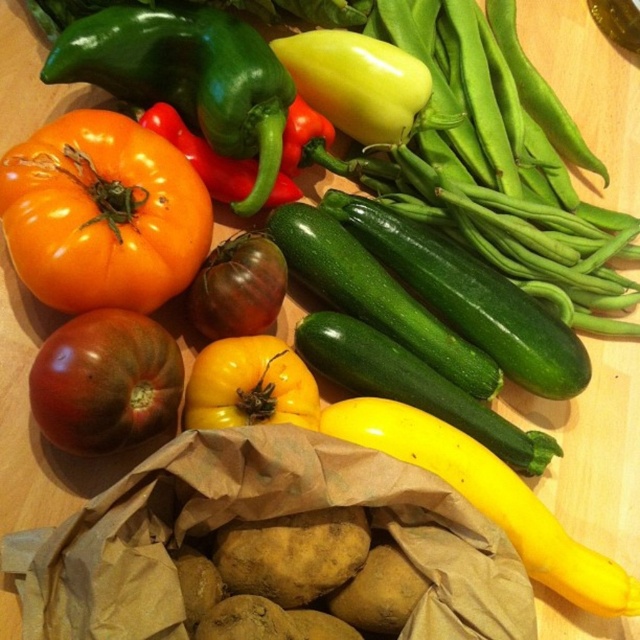
Which is above, rustic brown tomato at center-left or green glossy pepper at upper center?

green glossy pepper at upper center

Is rustic brown tomato at center-left closer to camera compared to green glossy pepper at upper center?

Yes, rustic brown tomato at center-left is in front of green glossy pepper at upper center.

This screenshot has height=640, width=640. I want to click on rustic brown tomato at center-left, so 106,381.

Is green glossy bell pepper at upper left further to the viewer compared to yellow matte tomato at center?

Yes, it is behind yellow matte tomato at center.

Is green glossy bell pepper at upper left to the right of yellow matte tomato at center from the viewer's perspective?

In fact, green glossy bell pepper at upper left is to the left of yellow matte tomato at center.

Which is behind, point (145, 26) or point (241, 371)?

Point (145, 26)

The height and width of the screenshot is (640, 640). Find the location of `green glossy bell pepper at upper left`. green glossy bell pepper at upper left is located at coordinates (188, 77).

Is yellow matte tomato at center taller than green glossy pepper at upper center?

No, yellow matte tomato at center is not taller than green glossy pepper at upper center.

Which is behind, point (225, 385) or point (228, 168)?

The point (228, 168) is behind.

In order to click on yellow matte tomato at center in this screenshot , I will do `click(250, 385)`.